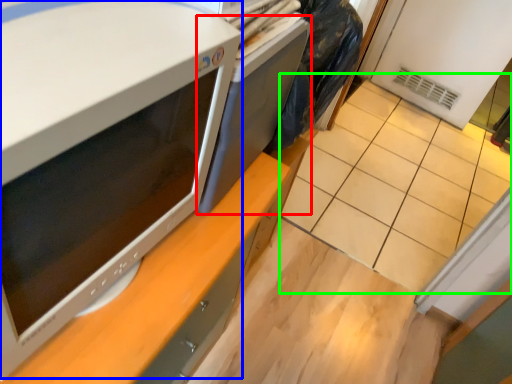
Question: Estimate the real-world distances between objects in this image. Which object is closer to desktop (highlighted by a red box), home appliance (highlighted by a blue box) or tile (highlighted by a green box)?

Choices:
 (A) home appliance
 (B) tile

Answer: (A)